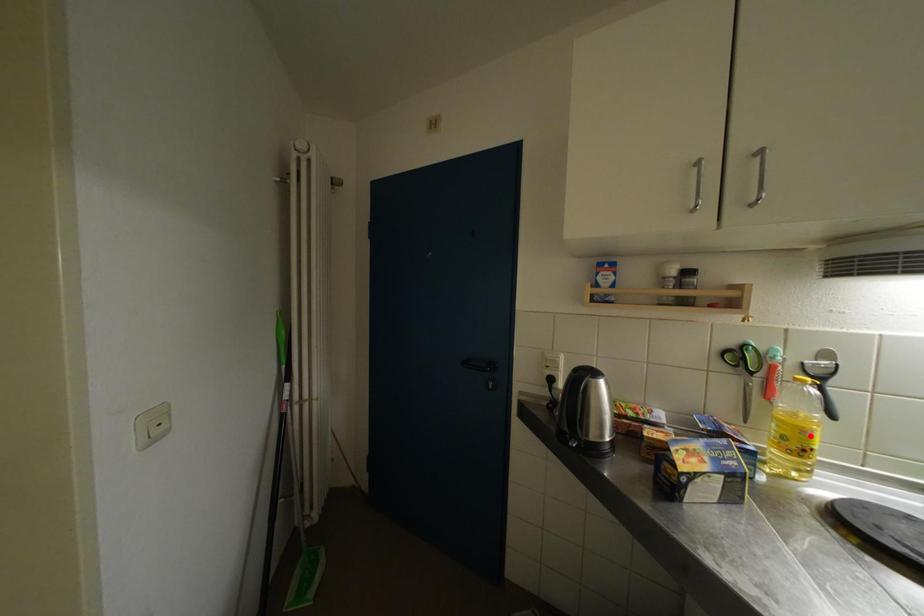
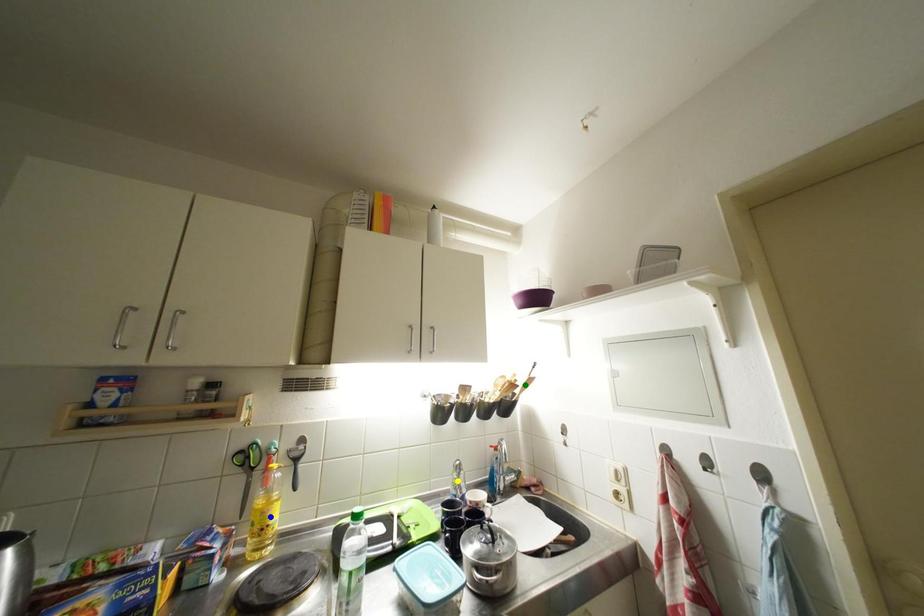
Question: I am providing you with two images of the same scene from different viewpoints. A red point is marked on the first image. You are given multiple points on the second image. Which point in image 2 represents the same 3d spot as the red point in image 1?

Choices:
 (A) yellow point
 (B) green point
 (C) blue point

Answer: (C)